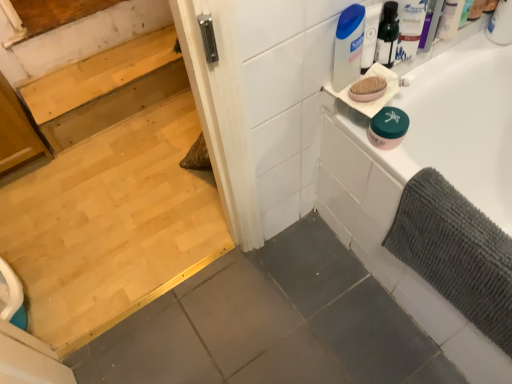
Locate an element on the screen. The image size is (512, 384). free space above light brown wood stairs at upper left (from a real-world perspective) is located at coordinates (98, 74).